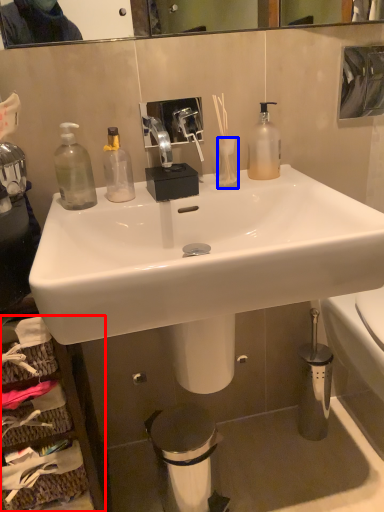
Question: Which object appears farthest to the camera in this image, cabinetry (highlighted by a red box) or vase (highlighted by a blue box)?

Choices:
 (A) cabinetry
 (B) vase

Answer: (B)